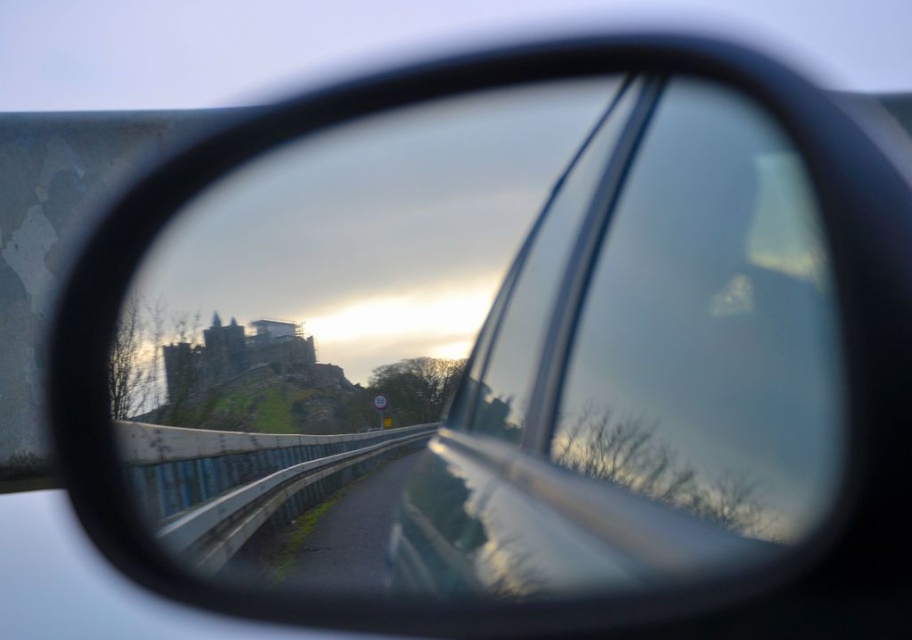
Question: Can you confirm if glossy metallic mirror at center is positioned to the right of metallic silver car window at center?

Choices:
 (A) yes
 (B) no

Answer: (B)

Question: Which of the following is the closest to the observer?

Choices:
 (A) (399, 232)
 (B) (772, 499)

Answer: (B)

Question: Which of the following is the closest to the observer?

Choices:
 (A) glossy metallic mirror at center
 (B) metallic silver car window at center

Answer: (B)

Question: Does glossy metallic mirror at center have a lesser width compared to metallic silver car window at center?

Choices:
 (A) no
 (B) yes

Answer: (A)

Question: Considering the relative positions of glossy metallic mirror at center and metallic silver car window at center in the image provided, where is glossy metallic mirror at center located with respect to metallic silver car window at center?

Choices:
 (A) left
 (B) right

Answer: (A)